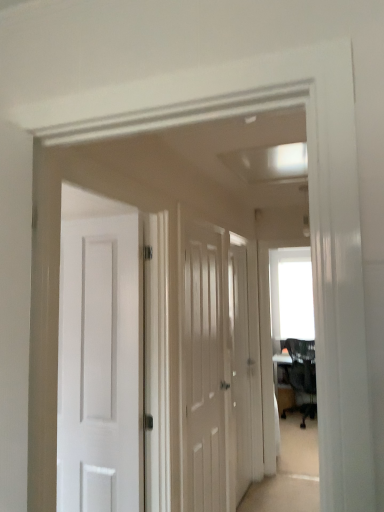
Question: Which direction should I rotate to look at white wooden door at center, the second door viewed from the front?

Choices:
 (A) left
 (B) right

Answer: (B)

Question: Is white wood door at center, which appears as the first door when viewed from the left, touching white wooden door at center, arranged as the 1th door when viewed from the right?

Choices:
 (A) no
 (B) yes

Answer: (A)

Question: From the image's perspective, is white wood door at center, the second door positioned from the right, under white wooden door at center, arranged as the 1th door when viewed from the right?

Choices:
 (A) no
 (B) yes

Answer: (A)

Question: From a real-world perspective, does white wood door at center, which ranks as the 1th door in front-to-back order, stand above white wooden door at center, the second door viewed from the front?

Choices:
 (A) yes
 (B) no

Answer: (A)

Question: Is the depth of white wood door at center, the second door positioned from the right, greater than that of white wooden door at center, the second door viewed from the front?

Choices:
 (A) no
 (B) yes

Answer: (A)

Question: Can you confirm if white wood door at center, the second door positioned from the right, is smaller than white wooden door at center, arranged as the 1th door when viewed from the right?

Choices:
 (A) no
 (B) yes

Answer: (A)

Question: Considering the relative sizes of white wood door at center, the second door positioned from the right, and white wooden door at center, arranged as the 1th door when viewed from the right, in the image provided, is white wood door at center, the second door positioned from the right, bigger than white wooden door at center, arranged as the 1th door when viewed from the right,?

Choices:
 (A) no
 (B) yes

Answer: (B)

Question: Does white wood door at center, the second door positioned from the right, have a greater height compared to black mesh chair at right?

Choices:
 (A) yes
 (B) no

Answer: (A)

Question: Is black mesh chair at right at the back of white wood door at center, the 2th door from the back?

Choices:
 (A) no
 (B) yes

Answer: (A)

Question: Is white wood door at center, which ranks as the 1th door in front-to-back order, at the left side of black mesh chair at right?

Choices:
 (A) no
 (B) yes

Answer: (B)

Question: From a real-world perspective, does white wood door at center, the 2th door from the back, stand above black mesh chair at right?

Choices:
 (A) no
 (B) yes

Answer: (B)

Question: Does white wood door at center, the second door positioned from the right, have a greater width compared to black mesh chair at right?

Choices:
 (A) no
 (B) yes

Answer: (A)

Question: Would you say white wood door at center, the 2th door from the back, is a long distance from black mesh chair at right?

Choices:
 (A) yes
 (B) no

Answer: (A)

Question: Is black mesh chair at right turned away from white wood door at center, which appears as the first door when viewed from the left?

Choices:
 (A) no
 (B) yes

Answer: (B)